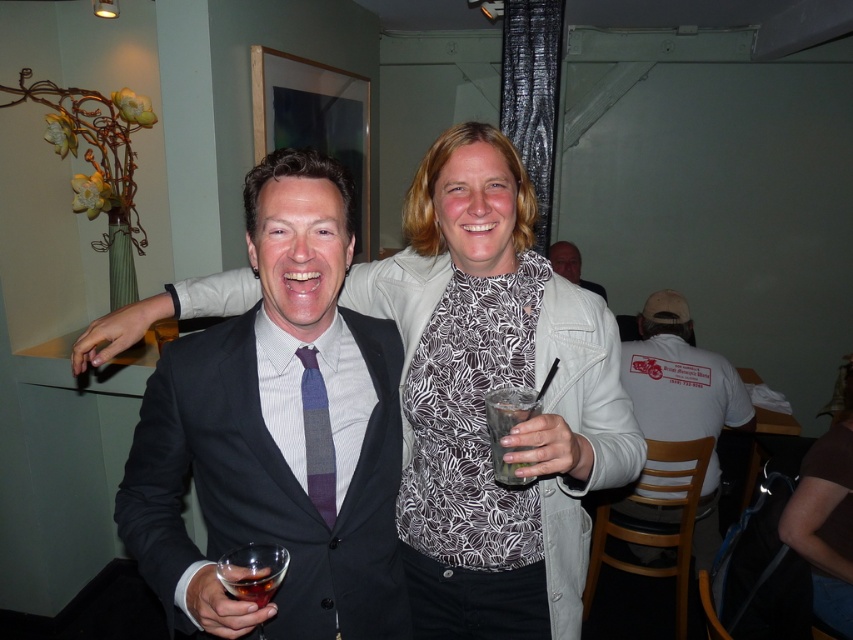
Does white cotton t-shirt at right have a smaller size compared to clear glass drink at center?

No, white cotton t-shirt at right is not smaller than clear glass drink at center.

Is white cotton t-shirt at right taller than clear glass drink at center?

Correct, white cotton t-shirt at right is much taller as clear glass drink at center.

Does point (717, 365) come behind point (518, 422)?

Yes, point (717, 365) is farther from viewer.

Where is `white cotton t-shirt at right`? The height and width of the screenshot is (640, 853). white cotton t-shirt at right is located at coordinates (679, 378).

Consider the image. Between clear glass drink at center and translucent glass at lower left, which one is positioned lower?

Positioned lower is translucent glass at lower left.

Does clear glass drink at center lie behind translucent glass at lower left?

Yes, it is.

Which is in front, point (498, 426) or point (277, 579)?

Point (277, 579) is more forward.

Where is `clear glass drink at center`? This screenshot has width=853, height=640. clear glass drink at center is located at coordinates (508, 428).

What do you see at coordinates (277, 432) in the screenshot? I see `matte black suit at center` at bounding box center [277, 432].

Between point (202, 397) and point (260, 608), which one is positioned in front?

Positioned in front is point (260, 608).

Is point (306, 216) farther from viewer compared to point (248, 577)?

Yes.

Locate an element on the screen. The image size is (853, 640). matte black suit at center is located at coordinates (277, 432).